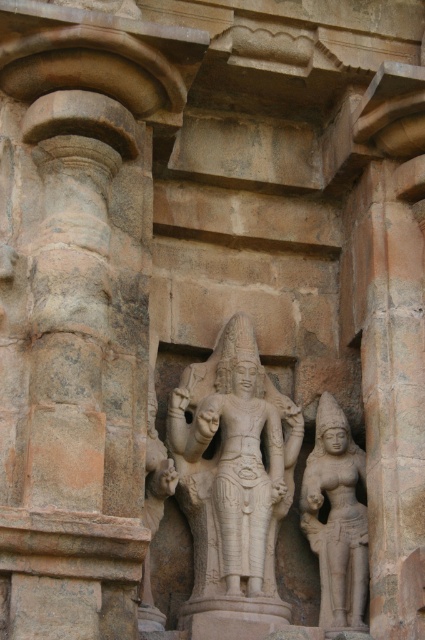
Question: Does white stone statue at center have a greater width compared to smooth stone statue at right?

Choices:
 (A) no
 (B) yes

Answer: (B)

Question: Does white stone statue at center appear on the right side of smooth stone statue at right?

Choices:
 (A) no
 (B) yes

Answer: (A)

Question: Is white stone statue at center to the left of smooth stone statue at right from the viewer's perspective?

Choices:
 (A) no
 (B) yes

Answer: (B)

Question: Which of the following is the farthest from the observer?

Choices:
 (A) (235, 376)
 (B) (356, 598)

Answer: (A)

Question: Which point appears closest to the camera in this image?

Choices:
 (A) (272, 545)
 (B) (357, 524)

Answer: (A)